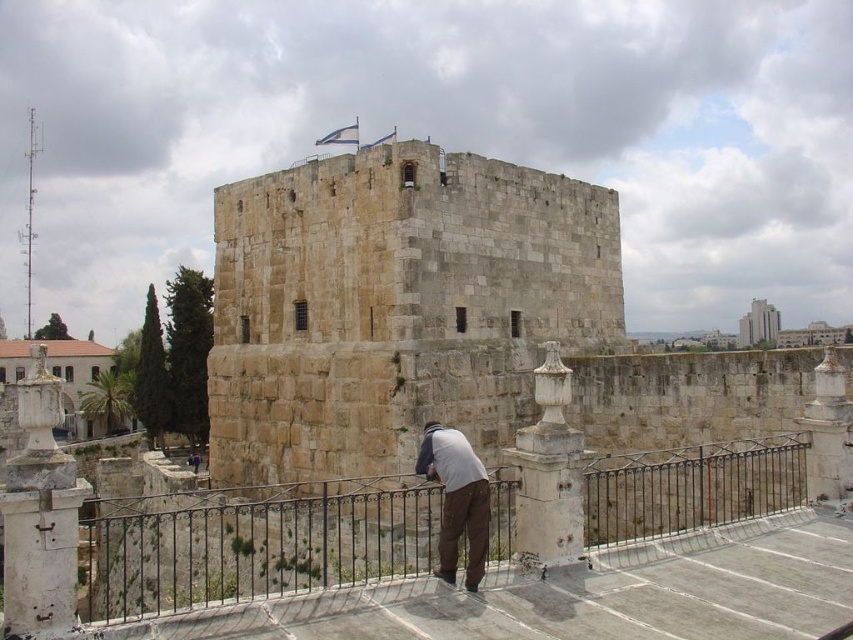
Question: Which of the following is the farthest from the observer?

Choices:
 (A) light gray fabric shirt at lower center
 (B) stone tower at center

Answer: (B)

Question: Can you confirm if black wrought iron railing at center is smaller than light gray fabric shirt at lower center?

Choices:
 (A) no
 (B) yes

Answer: (A)

Question: Which of the following is the farthest from the observer?

Choices:
 (A) light gray fabric shirt at lower center
 (B) stone tower at center

Answer: (B)

Question: Can you confirm if black wrought iron railing at center is positioned above light gray fabric shirt at lower center?

Choices:
 (A) yes
 (B) no

Answer: (B)

Question: Can you confirm if stone tower at center is positioned to the right of black wrought iron railing at center?

Choices:
 (A) yes
 (B) no

Answer: (A)

Question: Among these objects, which one is farthest from the camera?

Choices:
 (A) black wrought iron railing at center
 (B) light gray fabric shirt at lower center

Answer: (B)